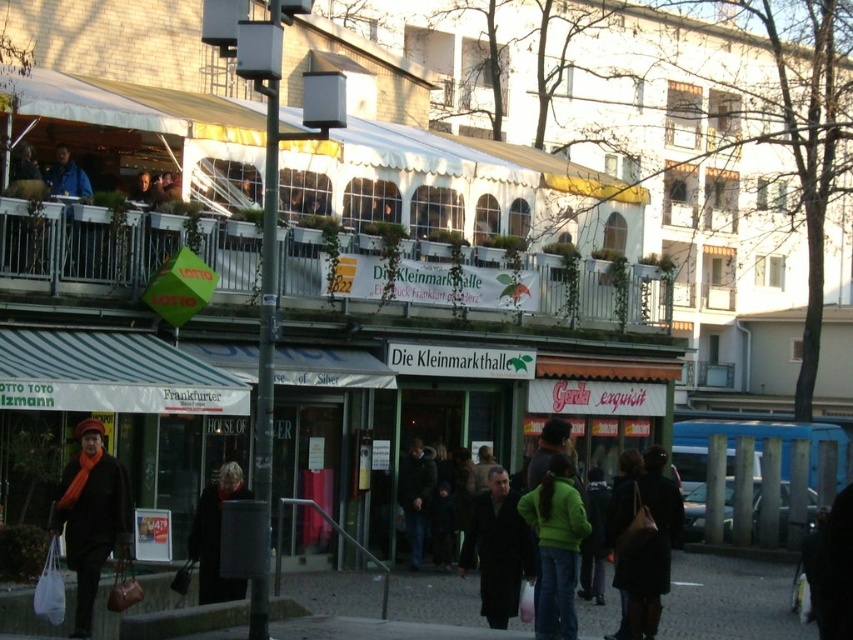
Which is behind, point (503, 548) or point (73, 179)?

The point (73, 179) is more distant.

Can you confirm if dark brown coat at center is wider than blue jacket at upper left?

Incorrect, dark brown coat at center's width does not surpass blue jacket at upper left's.

Where is `dark brown coat at center`? Image resolution: width=853 pixels, height=640 pixels. dark brown coat at center is located at coordinates (498, 548).

Can you confirm if dark gray asphalt at lower center is shorter than blue jacket at upper left?

In fact, dark gray asphalt at lower center may be taller than blue jacket at upper left.

Who is positioned more to the right, dark gray asphalt at lower center or blue jacket at upper left?

Positioned to the right is dark gray asphalt at lower center.

Find the location of a particular element. This screenshot has height=640, width=853. dark gray asphalt at lower center is located at coordinates (730, 600).

Locate an element on the screen. The width and height of the screenshot is (853, 640). dark gray asphalt at lower center is located at coordinates (730, 600).

Is point (558, 548) closer to camera compared to point (33, 605)?

No.

Does point (567, 605) come behind point (49, 589)?

Yes, point (567, 605) is behind point (49, 589).

Where is `green matte jacket at center`? green matte jacket at center is located at coordinates (555, 547).